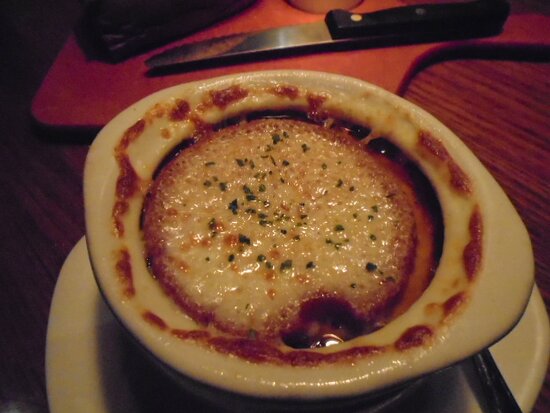
The image size is (550, 413). What are the coordinates of `bowl` in the screenshot? It's located at (509, 239).